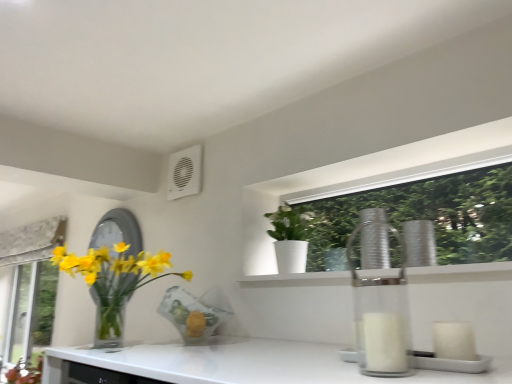
Question: Considering the relative positions of translucent glass vase at left, positioned as the 2th houseplant in right-to-left order, and white plastic air conditioning unit at upper center in the image provided, is translucent glass vase at left, positioned as the 2th houseplant in right-to-left order, to the right of white plastic air conditioning unit at upper center from the viewer's perspective?

Choices:
 (A) no
 (B) yes

Answer: (A)

Question: Is translucent glass vase at left, the 1th houseplant positioned from the left, positioned before white plastic air conditioning unit at upper center?

Choices:
 (A) no
 (B) yes

Answer: (B)

Question: Is translucent glass vase at left, the 1th houseplant positioned from the left, surrounding white plastic air conditioning unit at upper center?

Choices:
 (A) no
 (B) yes

Answer: (A)

Question: From the image's perspective, is translucent glass vase at left, positioned as the 2th houseplant in right-to-left order, below white plastic air conditioning unit at upper center?

Choices:
 (A) no
 (B) yes

Answer: (B)

Question: Is translucent glass vase at left, the 1th houseplant positioned from the left, facing away from white plastic air conditioning unit at upper center?

Choices:
 (A) yes
 (B) no

Answer: (B)

Question: Considering the relative sizes of translucent glass vase at left, the 1th houseplant positioned from the left, and white plastic air conditioning unit at upper center in the image provided, is translucent glass vase at left, the 1th houseplant positioned from the left, bigger than white plastic air conditioning unit at upper center?

Choices:
 (A) yes
 (B) no

Answer: (A)

Question: Can you confirm if silver metallic mirror at left is wider than white matte pot at upper center, which ranks as the 1th houseplant in right-to-left order?

Choices:
 (A) yes
 (B) no

Answer: (B)

Question: Is white matte pot at upper center, marked as the second houseplant in a left-to-right arrangement, at the back of silver metallic mirror at left?

Choices:
 (A) no
 (B) yes

Answer: (A)

Question: Could you tell me if silver metallic mirror at left is turned towards white matte pot at upper center, marked as the second houseplant in a left-to-right arrangement?

Choices:
 (A) no
 (B) yes

Answer: (A)

Question: From a real-world perspective, is silver metallic mirror at left beneath white matte pot at upper center, which ranks as the 1th houseplant in right-to-left order?

Choices:
 (A) yes
 (B) no

Answer: (A)

Question: Is silver metallic mirror at left closer to the viewer compared to white matte pot at upper center, marked as the second houseplant in a left-to-right arrangement?

Choices:
 (A) yes
 (B) no

Answer: (B)

Question: From the image's perspective, is silver metallic mirror at left located above white matte pot at upper center, marked as the second houseplant in a left-to-right arrangement?

Choices:
 (A) no
 (B) yes

Answer: (A)

Question: Is white matte pot at upper center, which ranks as the 1th houseplant in right-to-left order, smaller than silver metallic mirror at left?

Choices:
 (A) no
 (B) yes

Answer: (B)